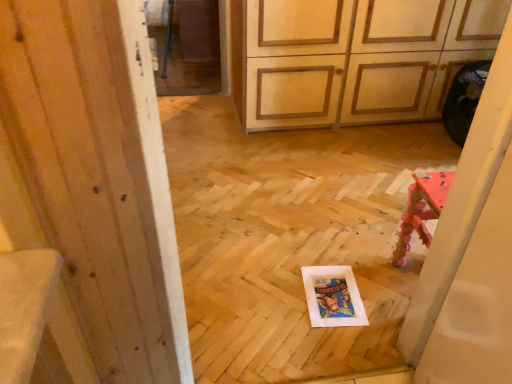
Image resolution: width=512 pixels, height=384 pixels. Identify the location of transparent glass screen door at upper left. (189, 50).

What do you see at coordinates (189, 50) in the screenshot? This screenshot has width=512, height=384. I see `transparent glass screen door at upper left` at bounding box center [189, 50].

Identify the location of transparent glass screen door at upper left. (189, 50).